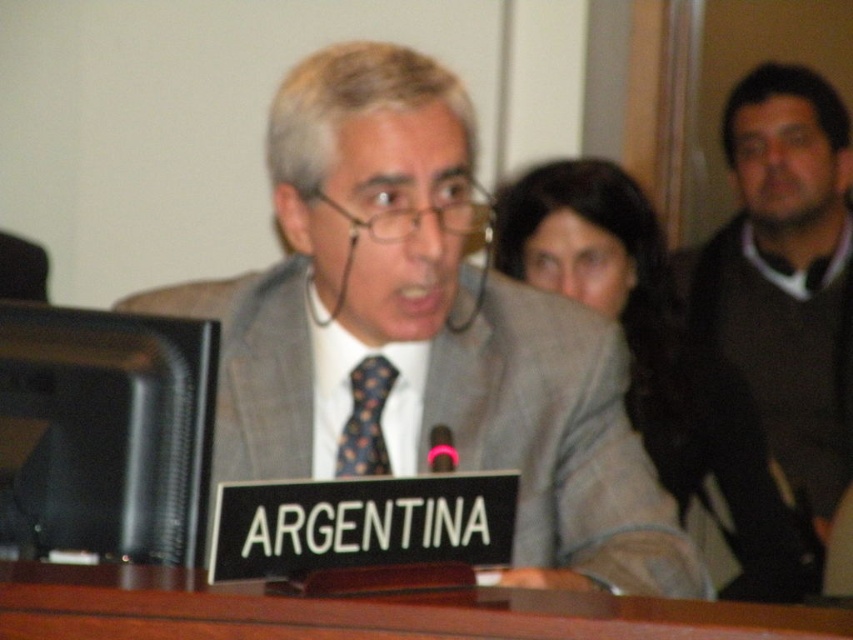
Who is positioned more to the left, brown wooden table at center or polka dot silk tie at center?

Positioned to the left is polka dot silk tie at center.

Does brown wooden table at center have a greater width compared to polka dot silk tie at center?

Correct, the width of brown wooden table at center exceeds that of polka dot silk tie at center.

You are a GUI agent. You are given a task and a screenshot of the screen. Output one action in this format:
    pyautogui.click(x=<x>, y=<y>)
    Task: Click on the brown wooden table at center
    The width and height of the screenshot is (853, 640).
    Given the screenshot: What is the action you would take?
    pyautogui.click(x=363, y=611)

Is dark gray suit at center bigger than polka dot silk tie at center?

Indeed, dark gray suit at center has a larger size compared to polka dot silk tie at center.

Which is more to the left, dark gray suit at center or polka dot silk tie at center?

polka dot silk tie at center is more to the left.

Who is more distant from viewer, (682, 400) or (367, 458)?

The point (682, 400) is behind.

Locate an element on the screen. This screenshot has width=853, height=640. dark gray suit at center is located at coordinates (660, 364).

Does gray suit at center have a lesser width compared to dark gray sweater at right?

No.

Who is lower down, gray suit at center or dark gray sweater at right?

gray suit at center

I want to click on gray suit at center, so click(x=426, y=330).